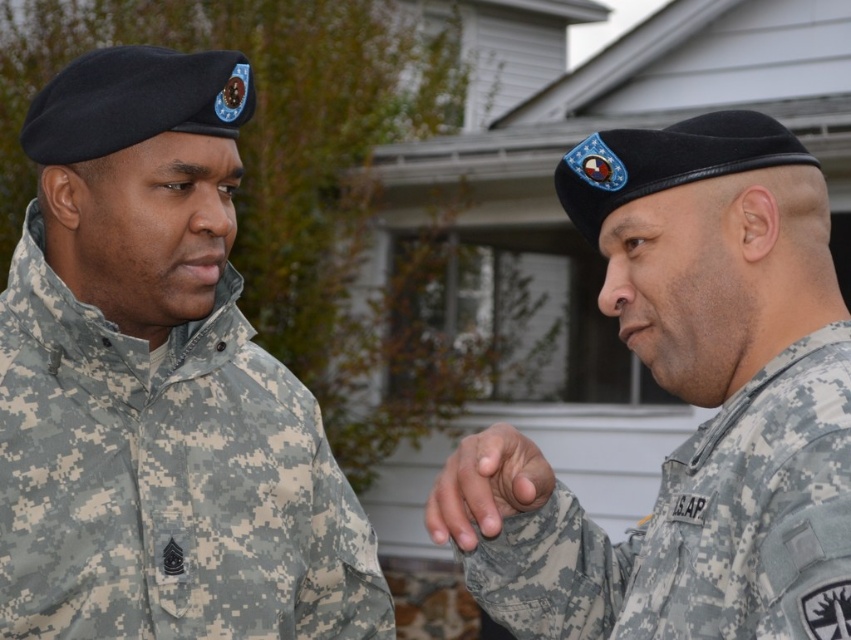
Is point (181, 266) closer to viewer compared to point (849, 612)?

No, it is not.

Can you confirm if camouflage fabric uniform at left is positioned above camouflage fabric beret at center?

No, camouflage fabric uniform at left is not above camouflage fabric beret at center.

Where is `camouflage fabric uniform at left`? Image resolution: width=851 pixels, height=640 pixels. camouflage fabric uniform at left is located at coordinates (158, 387).

Is camouflage fabric uniform at left positioned at the back of camouflage fabric hand at center?

Yes, camouflage fabric uniform at left is behind camouflage fabric hand at center.

Locate an element on the screen. This screenshot has height=640, width=851. camouflage fabric uniform at left is located at coordinates pyautogui.click(x=158, y=387).

The image size is (851, 640). What do you see at coordinates (158, 387) in the screenshot?
I see `camouflage fabric uniform at left` at bounding box center [158, 387].

In order to click on camouflage fabric uniform at left in this screenshot , I will do `click(158, 387)`.

In the scene shown: Can you confirm if camouflage fabric beret at center is smaller than camouflage fabric hand at center?

Actually, camouflage fabric beret at center might be larger than camouflage fabric hand at center.

Between camouflage fabric beret at center and camouflage fabric hand at center, which one has less height?

camouflage fabric hand at center is shorter.

The height and width of the screenshot is (640, 851). What do you see at coordinates (690, 403) in the screenshot?
I see `camouflage fabric beret at center` at bounding box center [690, 403].

This screenshot has height=640, width=851. In order to click on camouflage fabric beret at center in this screenshot , I will do `click(690, 403)`.